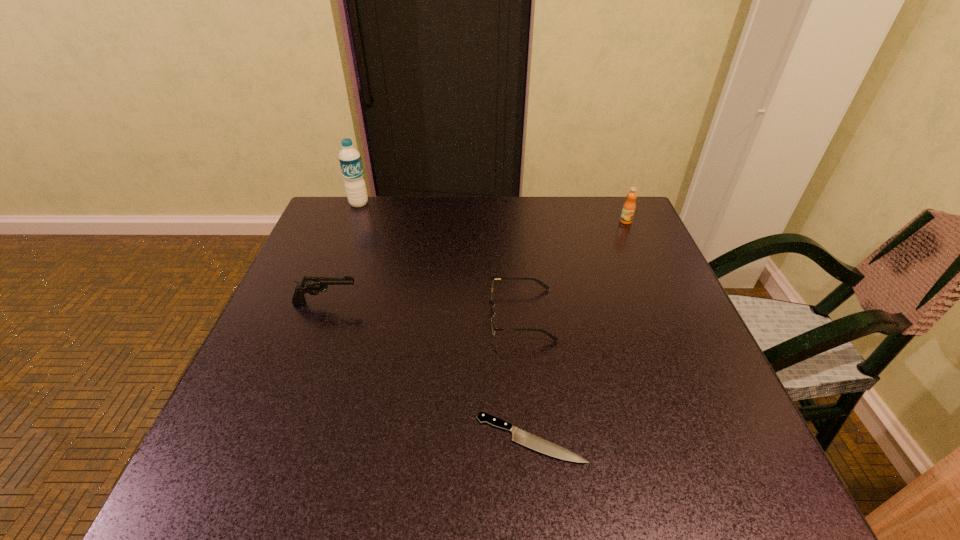
Find the location of a particular element. vacant space located 0.360m at the end of the barrel of the gun is located at coordinates (519, 302).

Locate an element on the screen. This screenshot has width=960, height=540. free spot located 0.200m on the front-facing side of the spectacles is located at coordinates [397, 314].

Where is `free location located on the front-facing side of the spectacles`? This screenshot has width=960, height=540. free location located on the front-facing side of the spectacles is located at coordinates [x=462, y=314].

Where is `free spot located on the front-facing side of the spectacles`? Image resolution: width=960 pixels, height=540 pixels. free spot located on the front-facing side of the spectacles is located at coordinates (361, 314).

You are a GUI agent. You are given a task and a screenshot of the screen. Output one action in this format:
    pyautogui.click(x=<x>, y=<y>)
    Task: Click on the vacant space located on the right of the nearest object
    The height and width of the screenshot is (540, 960).
    Given the screenshot: What is the action you would take?
    pyautogui.click(x=656, y=438)

Locate an element on the screen. This screenshot has height=540, width=960. water bottle situated at the far edge is located at coordinates (350, 161).

At what (x,y) coordinates should I click in order to perform the action: click on orange juice located at the far edge. Please return your answer as a coordinate pair (x, y). Looking at the image, I should click on (629, 206).

In order to click on object located in the near edge section of the desktop in this screenshot , I will do `click(522, 437)`.

The height and width of the screenshot is (540, 960). I want to click on water bottle that is positioned at the left edge, so click(x=350, y=161).

Find the location of a particular element. gun that is at the left edge is located at coordinates (313, 285).